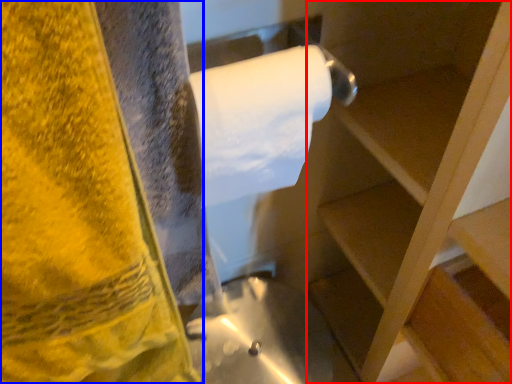
Question: Which point is further to the camera, shelf (highlighted by a red box) or towel (highlighted by a blue box)?

Choices:
 (A) shelf
 (B) towel

Answer: (B)